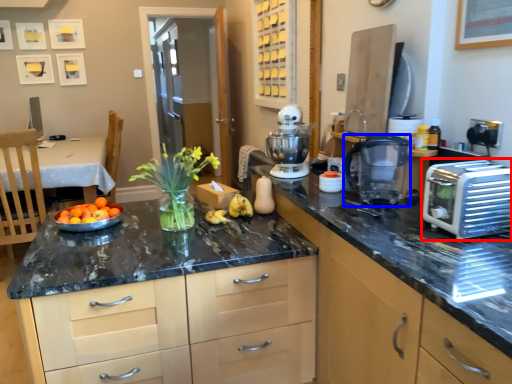
Question: Which point is further to the camera, toaster (highlighted by a red box) or kitchen appliance (highlighted by a blue box)?

Choices:
 (A) toaster
 (B) kitchen appliance

Answer: (B)